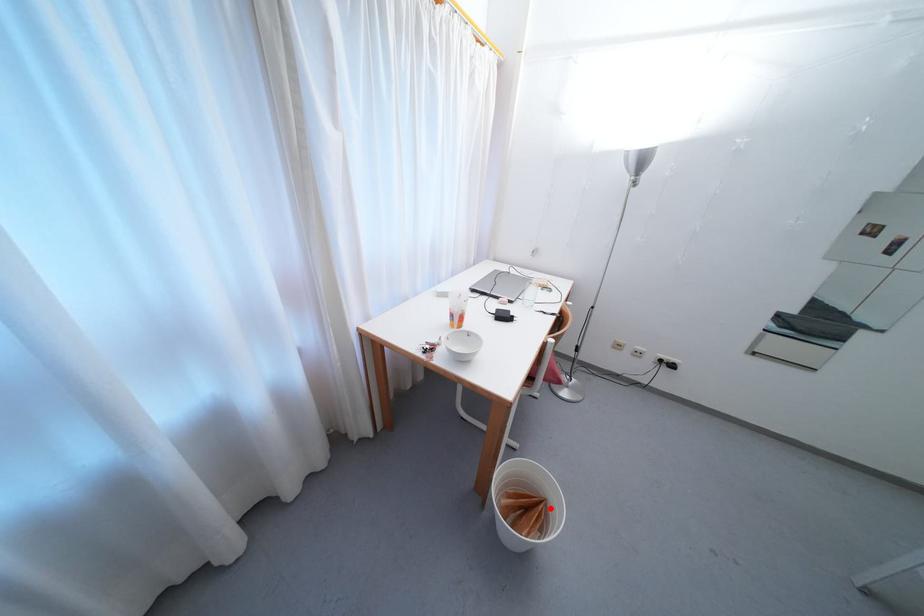
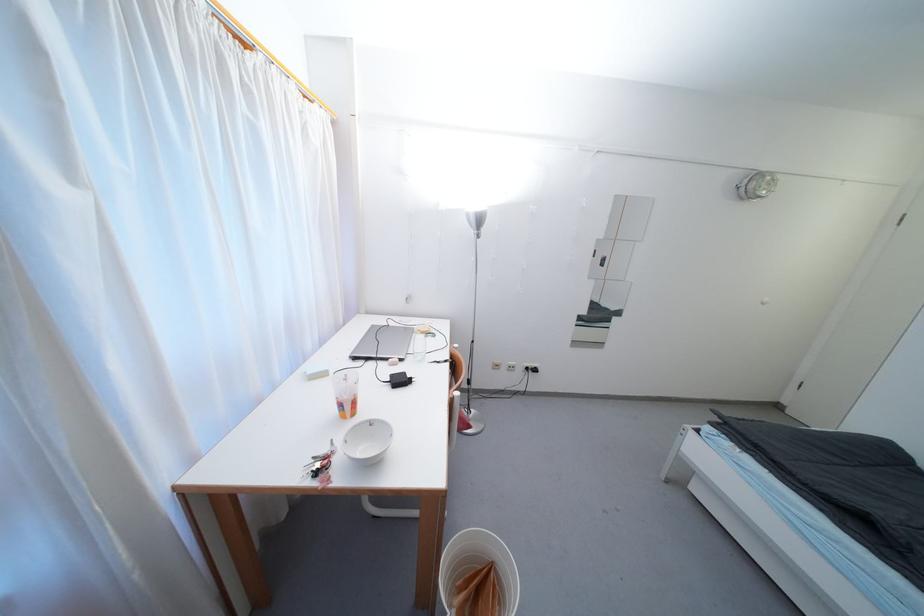
The point at the highlighted location is marked in the first image. Where is the corresponding point in the second image?

(499, 572)